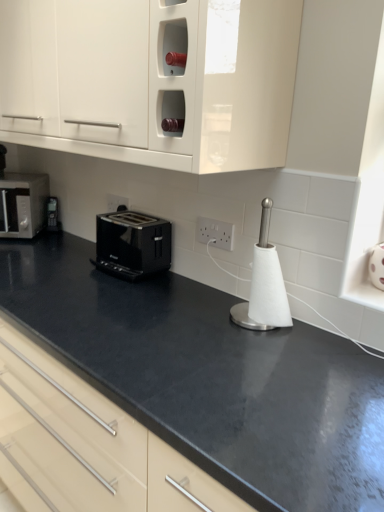
In order to face white plastic electric outlet at center, positioned as the 2th electric outlet in top-to-bottom order, should I rotate leftwards or rightwards?

Turn right approximately 3.194 degrees to face it.

This screenshot has width=384, height=512. What do you see at coordinates (215, 233) in the screenshot?
I see `white plastic electric outlet at center, placed as the first electric outlet when sorted from bottom to top` at bounding box center [215, 233].

Locate an element on the screen. Image resolution: width=384 pixels, height=512 pixels. black glossy toaster at center is located at coordinates (132, 244).

In order to face black glossy toaster at center, should I rotate leftwards or rightwards?

Turn left approximately 8.273 degrees to face it.

Image resolution: width=384 pixels, height=512 pixels. Find the location of `white glossy cabinet at upper center`. white glossy cabinet at upper center is located at coordinates (151, 80).

Where is `matte silver toaster at left`? This screenshot has width=384, height=512. matte silver toaster at left is located at coordinates (23, 204).

Which object is more forward, white glossy cabinet at upper center or white plastic electrical outlet at center, placed as the 2th electric outlet when sorted from bottom to top?

white glossy cabinet at upper center is closer to the camera.

Can you tell me how much white glossy cabinet at upper center and white plastic electrical outlet at center, the first electric outlet from the back, differ in facing direction?

There is a 0.396-degree angle between the facing directions of white glossy cabinet at upper center and white plastic electrical outlet at center, the first electric outlet from the back.

Is white plastic electrical outlet at center, placed as the second electric outlet when sorted from right to left, located within white glossy cabinet at upper center?

No, white plastic electrical outlet at center, placed as the second electric outlet when sorted from right to left, is not inside white glossy cabinet at upper center.

Is white glossy cabinet at upper center next to white plastic electrical outlet at center, placed as the 2th electric outlet when sorted from bottom to top, and touching it?

white glossy cabinet at upper center and white plastic electrical outlet at center, placed as the 2th electric outlet when sorted from bottom to top, are clearly separated.

Which of these two, white plastic electric outlet at center, the 1th electric outlet from the front, or black glossy toaster at center, is smaller?

white plastic electric outlet at center, the 1th electric outlet from the front.

In the scene shown: From the image's perspective, which is below, white plastic electric outlet at center, the 1th electric outlet from the front, or black glossy toaster at center?

black glossy toaster at center, from the image's perspective.

Is white plastic electric outlet at center, positioned as the 2th electric outlet in top-to-bottom order, turned away from black glossy toaster at center?

white plastic electric outlet at center, positioned as the 2th electric outlet in top-to-bottom order, does not have its back to black glossy toaster at center.

Considering the sizes of white plastic electric outlet at center, positioned as the 2th electric outlet in top-to-bottom order, and black glossy toaster at center in the image, is white plastic electric outlet at center, positioned as the 2th electric outlet in top-to-bottom order, taller or shorter than black glossy toaster at center?

white plastic electric outlet at center, positioned as the 2th electric outlet in top-to-bottom order, is shorter than black glossy toaster at center.

Is matte silver toaster at left facing towards white plastic electrical outlet at center, placed as the second electric outlet when sorted from right to left?

No, matte silver toaster at left is not aimed at white plastic electrical outlet at center, placed as the second electric outlet when sorted from right to left.

Is point (13, 219) positioned before point (117, 209)?

No, (13, 219) is behind (117, 209).

Find the location of a particular element. This screenshot has height=512, width=384. the 1st electric outlet below the matte silver toaster at left (from the image's perspective) is located at coordinates (117, 203).

Considering the sizes of matte silver toaster at left and white plastic electric outlet at center, which is the 2th electric outlet from left to right, in the image, is matte silver toaster at left taller or shorter than white plastic electric outlet at center, which is the 2th electric outlet from left to right,?

In the image, matte silver toaster at left appears to be taller than white plastic electric outlet at center, which is the 2th electric outlet from left to right.

Is matte silver toaster at left in front of or behind white plastic electric outlet at center, placed as the 2th electric outlet when sorted from back to front, in the image?

matte silver toaster at left is positioned farther from the viewer than white plastic electric outlet at center, placed as the 2th electric outlet when sorted from back to front.

From the image's perspective, who appears lower, matte silver toaster at left or white plastic electric outlet at center, which is the first electric outlet in right-to-left order?

white plastic electric outlet at center, which is the first electric outlet in right-to-left order, appears lower in the image.

Considering the positions of objects matte silver toaster at left and white plastic electric outlet at center, the 1th electric outlet from the front, in the image provided, who is more to the left, matte silver toaster at left or white plastic electric outlet at center, the 1th electric outlet from the front,?

matte silver toaster at left.

Does white plastic electrical outlet at center, the first electric outlet from the back, have a larger size compared to matte silver toaster at left?

No, white plastic electrical outlet at center, the first electric outlet from the back, is not bigger than matte silver toaster at left.

From the picture: From the image's perspective, which one is positioned lower, white plastic electrical outlet at center, the 2th electric outlet from the front, or matte silver toaster at left?

white plastic electrical outlet at center, the 2th electric outlet from the front, is shown below in the image.

From a real-world perspective, between white plastic electrical outlet at center, the 2th electric outlet from the front, and matte silver toaster at left, who is vertically higher?

white plastic electrical outlet at center, the 2th electric outlet from the front, is physically above.

Is white plastic electrical outlet at center, placed as the 2th electric outlet when sorted from bottom to top, positioned in front of matte silver toaster at left?

Yes, it is.

Identify the location of home appliance lying above the white paper towel holder at center (from the image's perspective). (23, 204).

Does white paper towel holder at center have a smaller size compared to matte silver toaster at left?

Yes, white paper towel holder at center is smaller than matte silver toaster at left.

Measure the distance between white paper towel holder at center and matte silver toaster at left.

white paper towel holder at center is 3.78 feet from matte silver toaster at left.

From the image's perspective, between white paper towel holder at center and matte silver toaster at left, who is located below?

white paper towel holder at center.

Does white plastic electric outlet at center, which is the 2th electric outlet from left to right, have a greater height compared to white paper towel holder at center?

No, white plastic electric outlet at center, which is the 2th electric outlet from left to right, is not taller than white paper towel holder at center.

Could white paper towel holder at center be considered to be inside white plastic electric outlet at center, positioned as the 2th electric outlet in top-to-bottom order?

That's incorrect, white paper towel holder at center is not inside white plastic electric outlet at center, positioned as the 2th electric outlet in top-to-bottom order.

Does point (213, 237) come in front of point (255, 273)?

No, it is not.

Looking at their sizes, would you say white plastic electric outlet at center, which is the 2th electric outlet from left to right, is wider or thinner than white paper towel holder at center?

white plastic electric outlet at center, which is the 2th electric outlet from left to right, is thinner than white paper towel holder at center.

I want to click on cabinetry that appears above the white plastic electrical outlet at center, placed as the second electric outlet when sorted from right to left (from a real-world perspective), so click(151, 80).

Where is `toaster located below the white plastic electric outlet at center, which is the first electric outlet in right-to-left order (from the image's perspective)`? toaster located below the white plastic electric outlet at center, which is the first electric outlet in right-to-left order (from the image's perspective) is located at coordinates (132, 244).

When comparing their distances from white plastic electric outlet at center, positioned as the 2th electric outlet in top-to-bottom order, does black glossy toaster at center or white glossy cabinet at upper center seem further?

white glossy cabinet at upper center lies further to white plastic electric outlet at center, positioned as the 2th electric outlet in top-to-bottom order, than the other object.

Based on their spatial positions, is matte silver toaster at left or black glossy toaster at center closer to white paper towel holder at center?

Based on the image, black glossy toaster at center appears to be nearer to white paper towel holder at center.

Estimate the real-world distances between objects in this image. Which object is further from white plastic electrical outlet at center, placed as the 2th electric outlet when sorted from bottom to top, matte silver toaster at left or white plastic electric outlet at center, which is the 2th electric outlet from left to right?

Among the two, white plastic electric outlet at center, which is the 2th electric outlet from left to right, is located further to white plastic electrical outlet at center, placed as the 2th electric outlet when sorted from bottom to top.

In the scene shown: Which object lies further to the anchor point white paper towel holder at center, white glossy cabinet at upper center or white plastic electrical outlet at center, placed as the 2th electric outlet when sorted from bottom to top?

The object further to white paper towel holder at center is white plastic electrical outlet at center, placed as the 2th electric outlet when sorted from bottom to top.

From the picture: Estimate the real-world distances between objects in this image. Which object is further from white paper towel holder at center, white plastic electrical outlet at center, which appears as the 1th electric outlet when viewed from the top, or matte silver toaster at left?

matte silver toaster at left lies further to white paper towel holder at center than the other object.

From the image, which object appears to be nearer to black glossy toaster at center, white plastic electric outlet at center, placed as the 2th electric outlet when sorted from back to front, or white paper towel holder at center?

white plastic electric outlet at center, placed as the 2th electric outlet when sorted from back to front, is positioned closer to the anchor black glossy toaster at center.

Estimate the real-world distances between objects in this image. Which object is closer to white plastic electrical outlet at center, the first electric outlet from the back, white glossy cabinet at upper center or matte silver toaster at left?

The object closer to white plastic electrical outlet at center, the first electric outlet from the back, is matte silver toaster at left.

Looking at the image, which one is located further to black glossy toaster at center, matte silver toaster at left or white paper towel holder at center?

matte silver toaster at left.

At what (x,y) coordinates should I click in order to perform the action: click on electric outlet located between matte silver toaster at left and white plastic electric outlet at center, placed as the 2th electric outlet when sorted from back to front, in the left-right direction. Please return your answer as a coordinate pair (x, y). The image size is (384, 512). Looking at the image, I should click on tap(117, 203).

In order to click on appliance between white glossy cabinet at upper center and white plastic electrical outlet at center, the first electric outlet viewed from the left, along the z-axis in this screenshot , I will do `click(264, 285)`.

Locate an element on the screen. This screenshot has height=512, width=384. toaster between matte silver toaster at left and white paper towel holder at center is located at coordinates (132, 244).

The width and height of the screenshot is (384, 512). I want to click on electric outlet between black glossy toaster at center and white paper towel holder at center, so click(x=215, y=233).